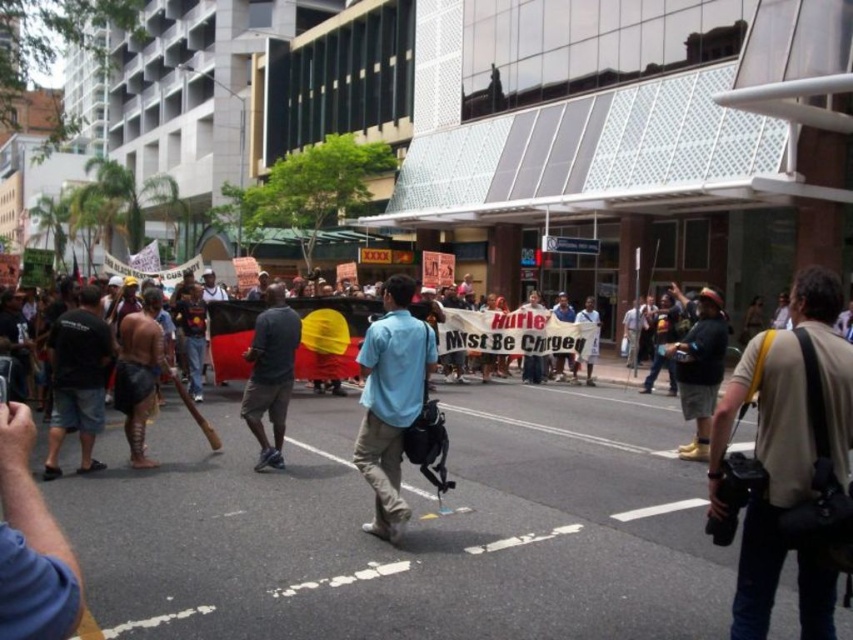
Which is more to the right, yellow rubber boots at right or blue shirt at center?

From the viewer's perspective, blue shirt at center appears more on the right side.

Does yellow rubber boots at right have a greater height compared to blue shirt at center?

No, yellow rubber boots at right is not taller than blue shirt at center.

Between point (705, 296) and point (570, 356), which one is positioned in front?

Point (705, 296) is in front.

I want to click on yellow rubber boots at right, so click(700, 369).

Between black cotton shirt at left and white paper banner at center, which one is positioned lower?

black cotton shirt at left is lower down.

Is black cotton shirt at left to the left of white paper banner at center from the viewer's perspective?

Indeed, black cotton shirt at left is positioned on the left side of white paper banner at center.

Measure the distance between black cotton shirt at left and camera.

black cotton shirt at left is 6.83 meters from camera.

Find the location of a particular element. The height and width of the screenshot is (640, 853). black cotton shirt at left is located at coordinates [x=78, y=380].

Between black cotton shirt at left and dark brown leather jacket at center, which one is positioned lower?

dark brown leather jacket at center is lower down.

Is point (54, 444) closer to viewer compared to point (648, 374)?

Yes, point (54, 444) is in front of point (648, 374).

Locate an element on the screen. black cotton shirt at left is located at coordinates (78, 380).